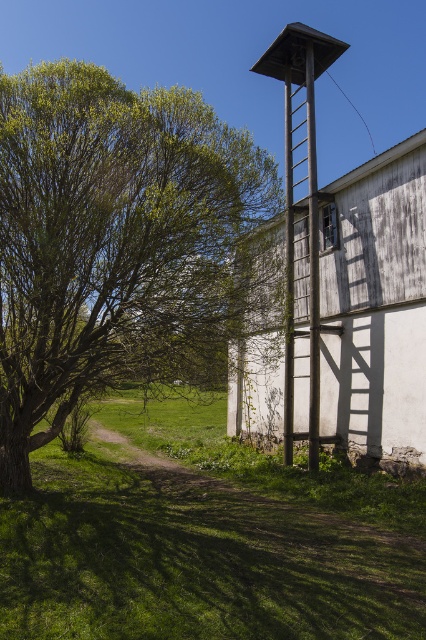
Question: Which object is closer to the camera taking this photo?

Choices:
 (A) green leafy tree at left
 (B) wooden water tower at center-right

Answer: (A)

Question: In this image, where is green leafy tree at left located relative to wooden water tower at center-right?

Choices:
 (A) below
 (B) above

Answer: (A)

Question: Does green leafy tree at left appear on the right side of wooden water tower at center-right?

Choices:
 (A) yes
 (B) no

Answer: (B)

Question: Does green leafy tree at left appear under wooden water tower at center-right?

Choices:
 (A) yes
 (B) no

Answer: (A)